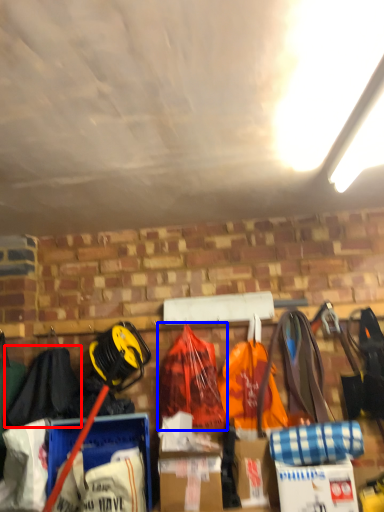
Question: Which object appears closest to the camera in this image, clothing (highlighted by a red box) or backpack (highlighted by a blue box)?

Choices:
 (A) clothing
 (B) backpack

Answer: (A)